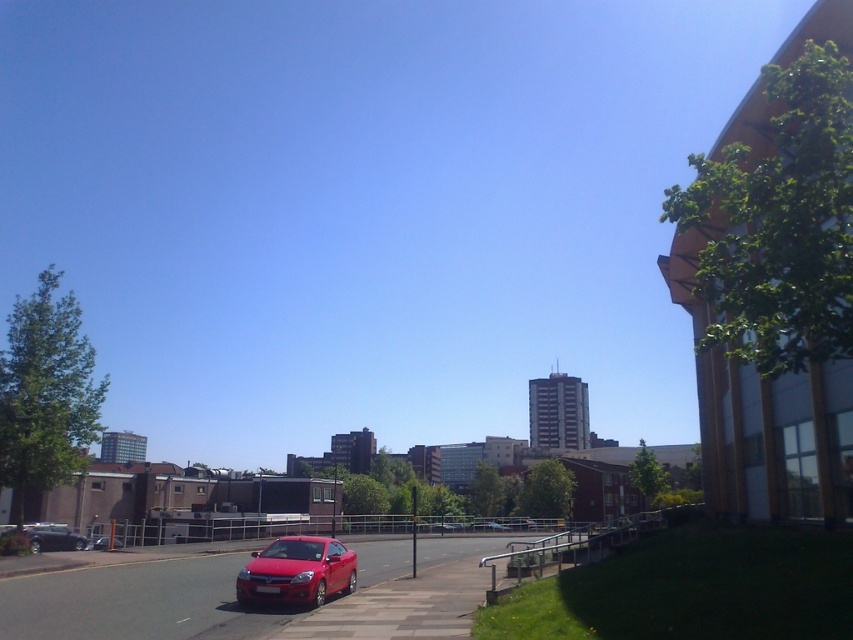
You are standing at the origin point of the coordinate system where the bottom left corner of the image is the origin. The image has a coordinate system where the x and y axes increase to the right and up respectively. You want to locate the glossy red car at center. What are its coordinates?

The glossy red car at center is located at coordinates point (297,572).

You are standing at the origin point in the image. Which direction should you move to reach the smooth asphalt road at lower center?

The smooth asphalt road at lower center is located at point (136, 602), so you should move towards the lower right direction from the origin point.

You are standing on the sidewalk looking at the smooth asphalt road at lower center and the glossy red car at center. Which object is closer to the ground?

The smooth asphalt road at lower center is closer to the ground because it is below the glossy red car at center.